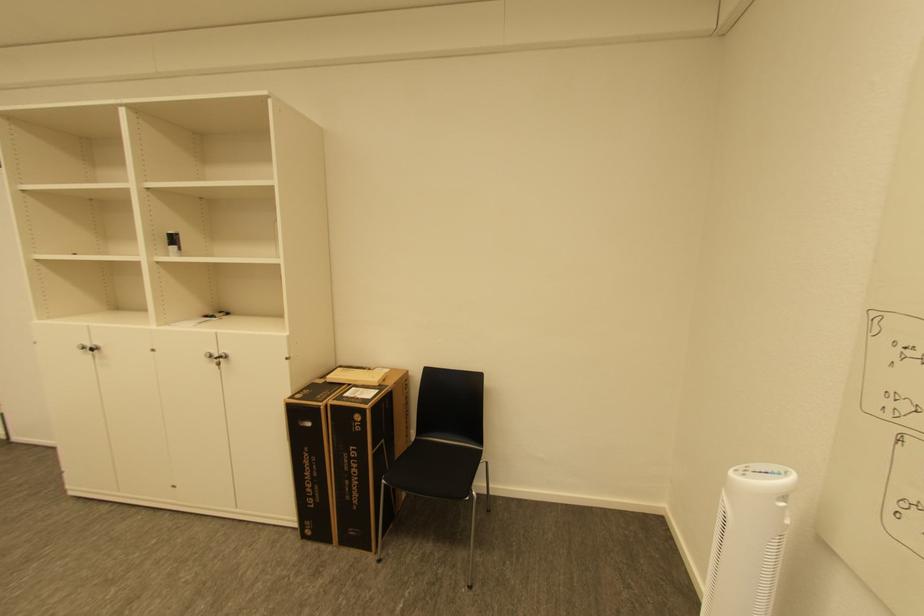
Where is `fan control panel`? Image resolution: width=924 pixels, height=616 pixels. fan control panel is located at coordinates (768, 576).